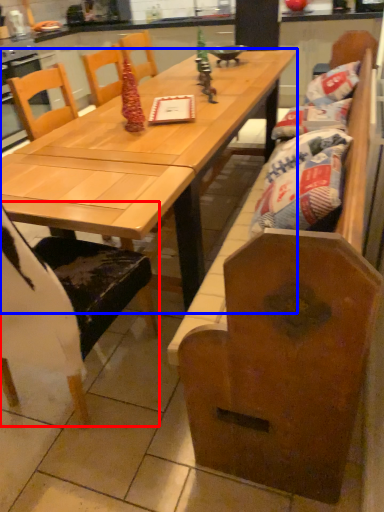
Question: Which object is closer to the camera taking this photo, chair (highlighted by a red box) or table (highlighted by a blue box)?

Choices:
 (A) chair
 (B) table

Answer: (A)